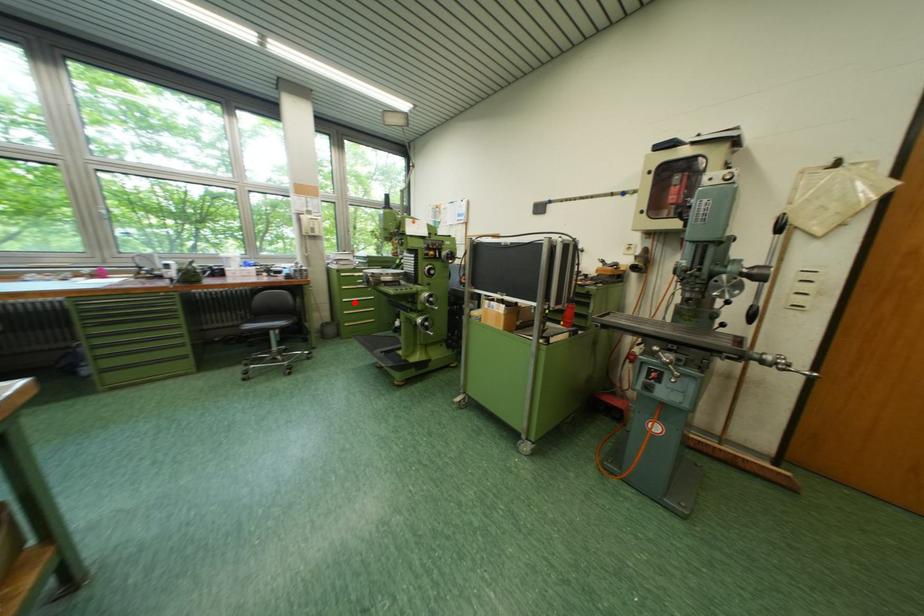
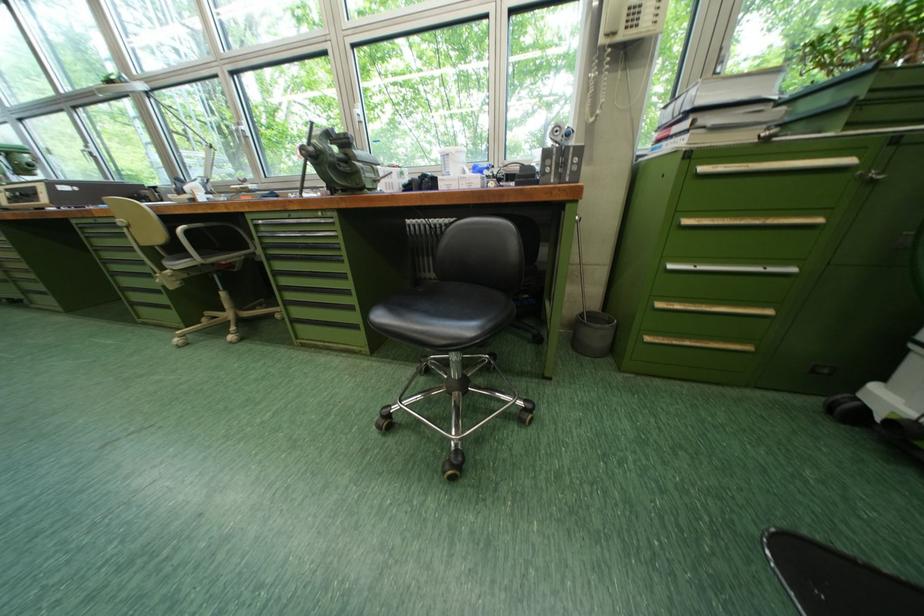
Question: I am providing you with two images of the same scene from different viewpoints. Image1 has a red point marked. In image2, the corresponding 3D location appears at what relative position? Reply with the corresponding letter.

Choices:
 (A) Closer
 (B) Farther

Answer: (B)